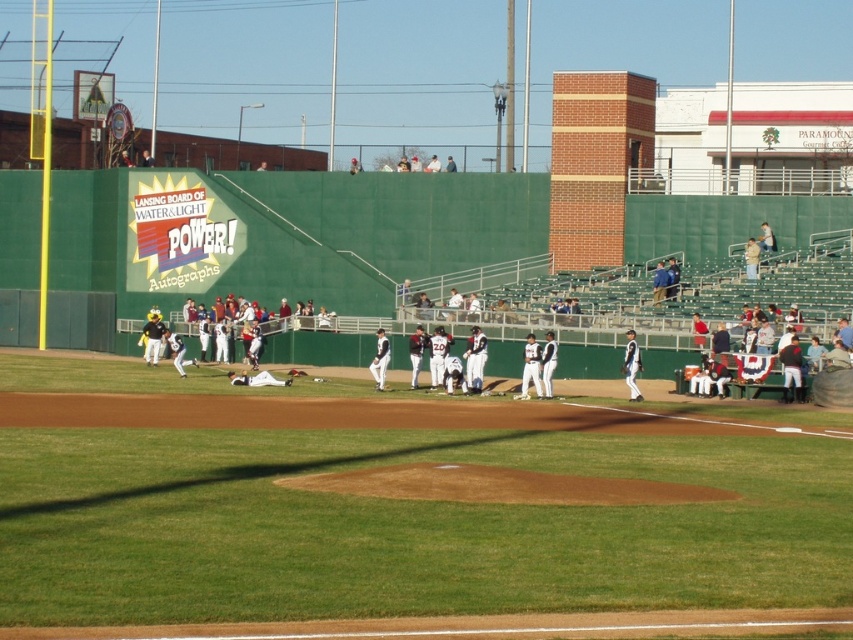
You are a drone operator controlling a drone that needs to fly from point A to point B in the baseball stadium image. The points are labeled as point (33,579) and point (379,388). According to the scene, which point is closer to the camera?

Point (33,579) is closer to the camera because it is in front of point (379,388).

Based on the scene description, where is the point located at coordinates (405, 524)?

The point at coordinates (405, 524) is located on the green grass field at center.

You are a spectator at the baseball game and want to take a photo of the white uniformed player at center without the green grass field at center blocking the view. Is this possible based on their positions?

The green grass field at center is in front of the white uniformed player at center, so taking a photo without the field blocking the player would not be possible as the field is closer to the camera.